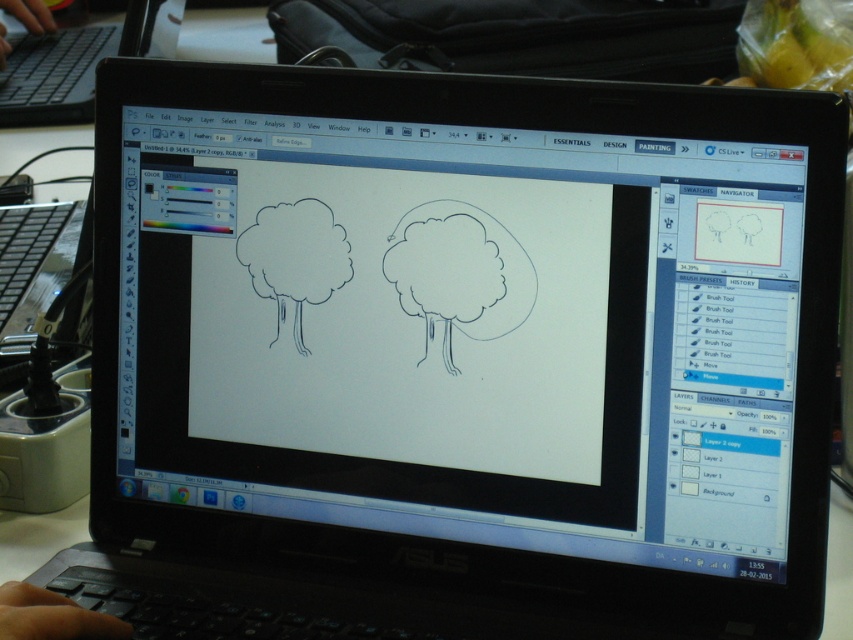
You are a digital artist trying to select the correct tool from the toolbar on the left. You see a point marked at coordinates point [51,616]. Is this point located on the left side of the screen?

The point [51,616] is at the lower left, so yes, it is on the left side of the screen.

You are trying to place a 10cm wide sticker on your desk. You have a black plastic laptop at upper left and a skinny finger at lower left in view. Which object would require a larger desk space to place the sticker next to it?

The black plastic laptop at upper left requires more desk space because its width is larger than the skinny finger at lower left.